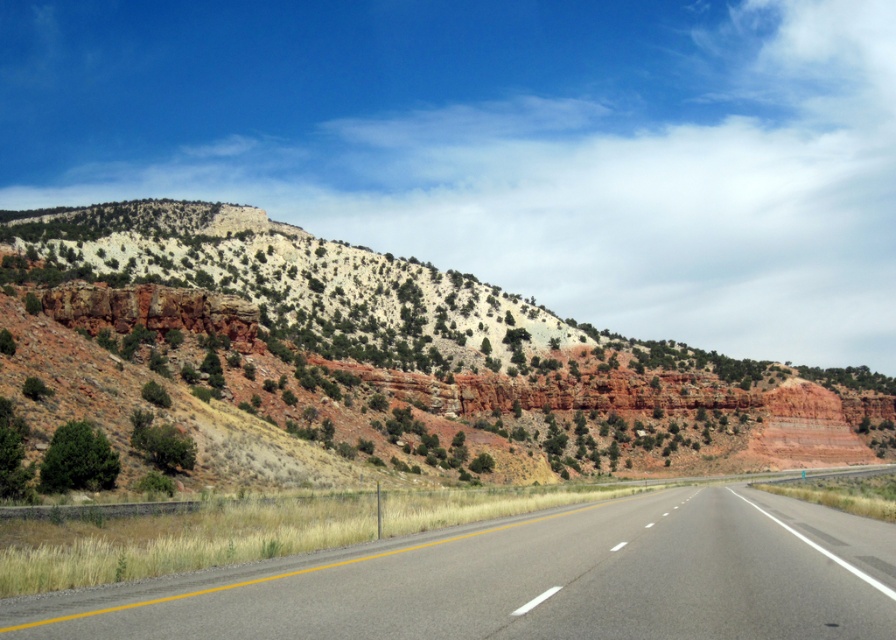
Question: Does rustic rock formation at center have a smaller size compared to gray asphalt highway at center?

Choices:
 (A) no
 (B) yes

Answer: (A)

Question: Observing the image, what is the correct spatial positioning of rustic rock formation at center in reference to gray asphalt highway at center?

Choices:
 (A) below
 (B) above

Answer: (B)

Question: Does rustic rock formation at center come in front of gray asphalt highway at center?

Choices:
 (A) yes
 (B) no

Answer: (B)

Question: Which object appears closest to the camera in this image?

Choices:
 (A) gray asphalt highway at center
 (B) rustic rock formation at center

Answer: (A)

Question: Which point is closer to the camera?

Choices:
 (A) gray asphalt highway at center
 (B) rustic rock formation at center

Answer: (A)